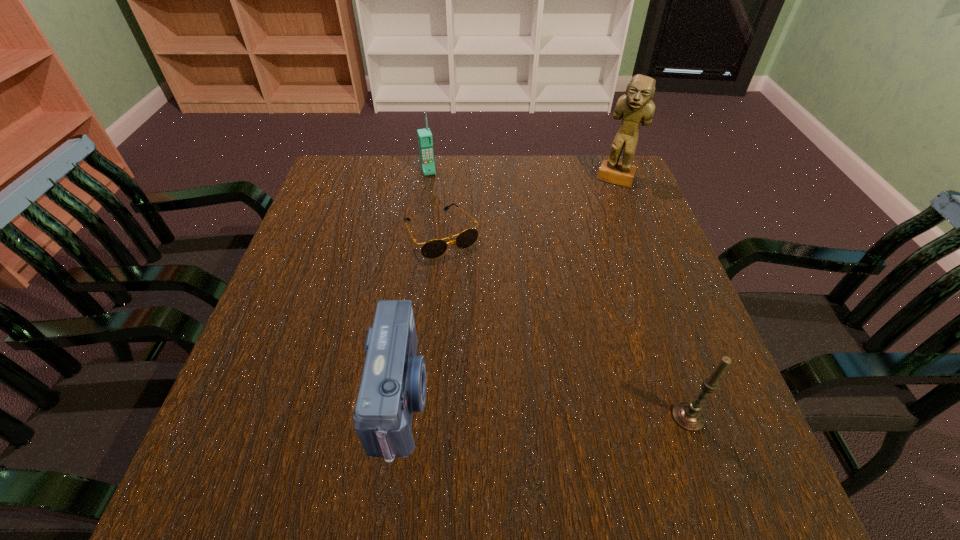
I want to click on the second shortest object, so click(393, 385).

The image size is (960, 540). Identify the location of candle. (688, 415).

Locate an element on the screen. The width and height of the screenshot is (960, 540). cellular telephone is located at coordinates (425, 141).

Identify the location of the shortest object. The width and height of the screenshot is (960, 540). (435, 248).

Where is `the third farthest object`? the third farthest object is located at coordinates (435, 248).

This screenshot has width=960, height=540. In order to click on figurine in this screenshot , I will do `click(636, 106)`.

At what (x,y) coordinates should I click in order to perform the action: click on free location located 0.370m on the lens of the fourth tallest object. Please return your answer as a coordinate pair (x, y). This screenshot has height=540, width=960. Looking at the image, I should click on (631, 397).

At what (x,y) coordinates should I click in order to perform the action: click on free space located 0.070m on the back of the candle. Please return your answer as a coordinate pair (x, y). Looking at the image, I should click on (671, 369).

You are a GUI agent. You are given a task and a screenshot of the screen. Output one action in this format:
    pyautogui.click(x=<x>, y=<y>)
    Task: Click on the vacant point located 0.280m on the keypad of the cellular telephone
    
    Given the screenshot: What is the action you would take?
    pyautogui.click(x=451, y=235)

Find the location of a particular element. free region located on the keypad of the cellular telephone is located at coordinates (457, 251).